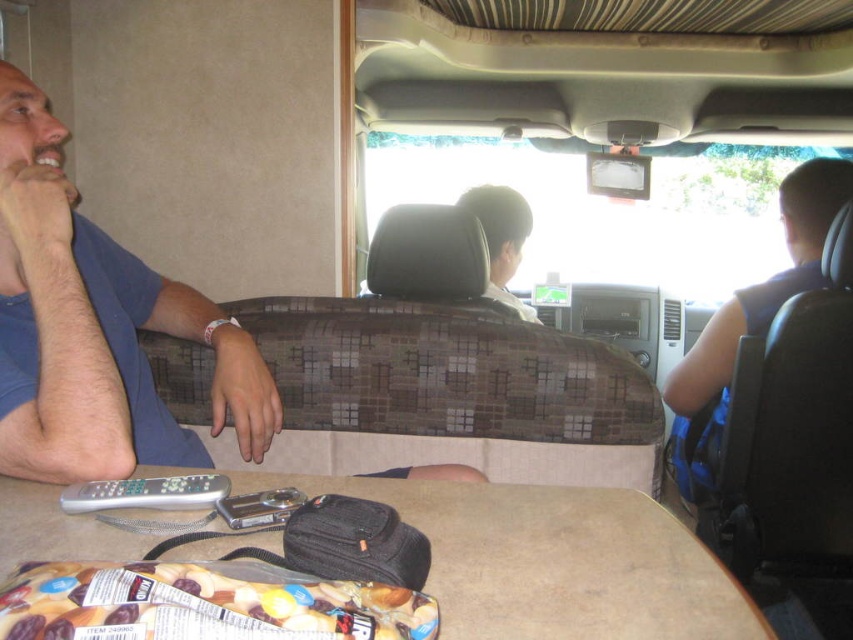
Looking at this image, is blue cotton shirt at left wider than brown matte table at lower center?

Incorrect, blue cotton shirt at left's width does not surpass brown matte table at lower center's.

Can you confirm if blue cotton shirt at left is shorter than brown matte table at lower center?

Incorrect, blue cotton shirt at left's height does not fall short of brown matte table at lower center's.

Find the location of `blue cotton shirt at left`. blue cotton shirt at left is located at coordinates (96, 326).

Which is behind, point (524, 605) or point (108, 586)?

Point (524, 605)

In the scene shown: Is brown matte table at lower center to the left of chocolate-coated nuts at lower center from the viewer's perspective?

No, brown matte table at lower center is not to the left of chocolate-coated nuts at lower center.

You are a GUI agent. You are given a task and a screenshot of the screen. Output one action in this format:
    pyautogui.click(x=<x>, y=<y>)
    Task: Click on the brown matte table at lower center
    The image size is (853, 640).
    Given the screenshot: What is the action you would take?
    pyautogui.click(x=554, y=561)

Does chocolate-coated nuts at lower center have a smaller size compared to dark gray fabric headrest at center?

Correct, chocolate-coated nuts at lower center occupies less space than dark gray fabric headrest at center.

Is chocolate-coated nuts at lower center wider than dark gray fabric headrest at center?

Correct, the width of chocolate-coated nuts at lower center exceeds that of dark gray fabric headrest at center.

Locate an element on the screen. chocolate-coated nuts at lower center is located at coordinates (202, 604).